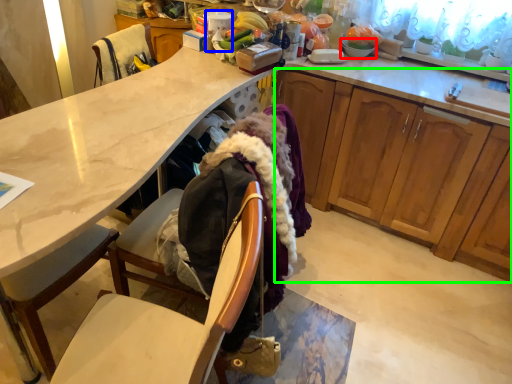
Question: Which object is the farthest from tableware (highlighted by a red box)? Choose among these: kitchen appliance (highlighted by a blue box) or cabinetry (highlighted by a green box).

Choices:
 (A) kitchen appliance
 (B) cabinetry

Answer: (A)